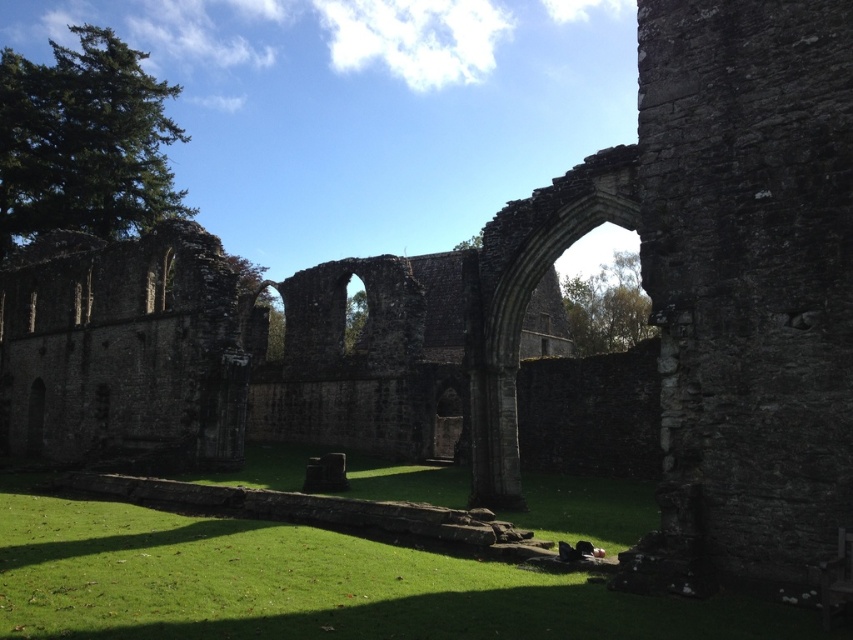
Question: Which point is farther to the camera?

Choices:
 (A) green grass at lower center
 (B) stone archway at center

Answer: (B)

Question: Which point is closer to the camera taking this photo?

Choices:
 (A) (779, 637)
 (B) (619, 148)

Answer: (A)

Question: Does green grass at lower center have a lesser width compared to stone archway at center?

Choices:
 (A) no
 (B) yes

Answer: (A)

Question: Can you confirm if green grass at lower center is positioned below stone archway at center?

Choices:
 (A) yes
 (B) no

Answer: (A)

Question: Is green grass at lower center smaller than stone archway at center?

Choices:
 (A) no
 (B) yes

Answer: (B)

Question: Among these objects, which one is farthest from the camera?

Choices:
 (A) stone archway at center
 (B) green grass at lower center

Answer: (A)